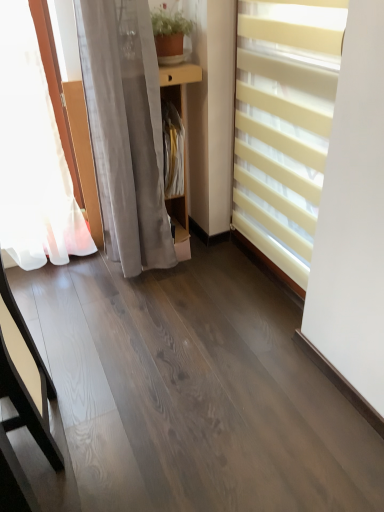
Question: Is matte yellow blinds at right aimed at wooden shelf at center?

Choices:
 (A) yes
 (B) no

Answer: (B)

Question: From the image's perspective, is matte yellow blinds at right below wooden shelf at center?

Choices:
 (A) no
 (B) yes

Answer: (B)

Question: Does matte yellow blinds at right have a lesser height compared to wooden shelf at center?

Choices:
 (A) no
 (B) yes

Answer: (A)

Question: Is matte yellow blinds at right positioned beyond the bounds of wooden shelf at center?

Choices:
 (A) yes
 (B) no

Answer: (A)

Question: Does matte yellow blinds at right come behind wooden shelf at center?

Choices:
 (A) yes
 (B) no

Answer: (B)

Question: Is matte yellow blinds at right far from wooden shelf at center?

Choices:
 (A) yes
 (B) no

Answer: (B)

Question: Does sheer white curtain at left have a lesser width compared to light brown wood table at left?

Choices:
 (A) yes
 (B) no

Answer: (B)

Question: From the image's perspective, is sheer white curtain at left located beneath light brown wood table at left?

Choices:
 (A) yes
 (B) no

Answer: (B)

Question: Is the depth of sheer white curtain at left greater than that of light brown wood table at left?

Choices:
 (A) yes
 (B) no

Answer: (A)

Question: Is light brown wood table at left at the back of sheer white curtain at left?

Choices:
 (A) yes
 (B) no

Answer: (B)

Question: Is sheer white curtain at left outside of light brown wood table at left?

Choices:
 (A) yes
 (B) no

Answer: (A)

Question: Does sheer white curtain at left have a lesser height compared to light brown wood table at left?

Choices:
 (A) yes
 (B) no

Answer: (B)

Question: Is wooden shelf at center positioned behind matte yellow blinds at right?

Choices:
 (A) yes
 (B) no

Answer: (A)